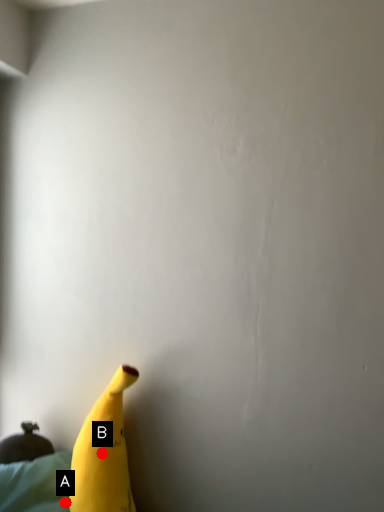
Question: Two points are circled on the image, labeled by A and B beside each circle. Which point is closer to the camera?

Choices:
 (A) A is closer
 (B) B is closer

Answer: (B)